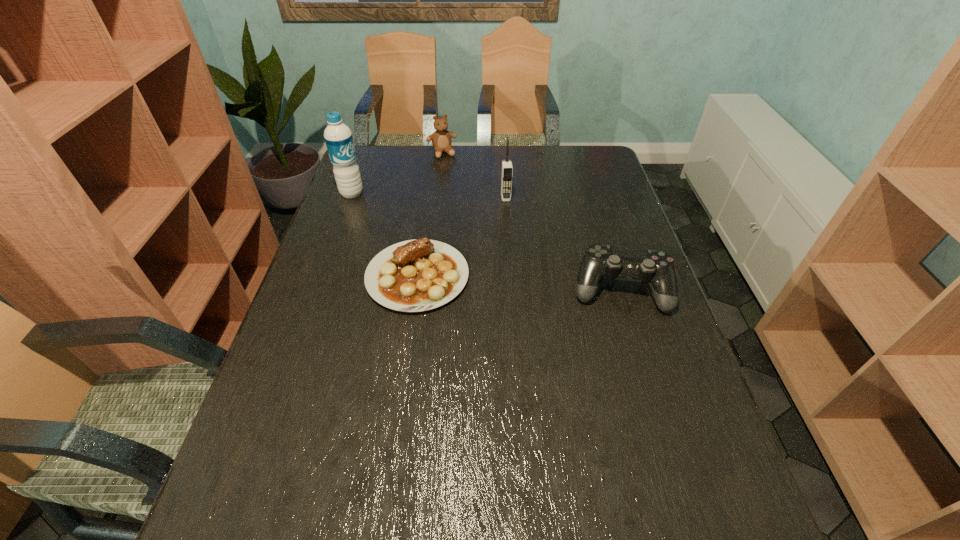
Identify the location of the shortest object. The image size is (960, 540). (417, 275).

Locate an element on the screen. The width and height of the screenshot is (960, 540). control is located at coordinates (656, 268).

Identify the location of the second shortest object. This screenshot has width=960, height=540. (656, 268).

The width and height of the screenshot is (960, 540). Identify the location of water bottle. (338, 137).

At what (x,y) coordinates should I click in order to perform the action: click on the tallest object. Please return your answer as a coordinate pair (x, y). Looking at the image, I should click on (338, 137).

The image size is (960, 540). Find the location of `the third shortest object`. the third shortest object is located at coordinates (441, 139).

Locate an element on the screen. The width and height of the screenshot is (960, 540). teddy bear is located at coordinates (441, 139).

Locate an element on the screen. The width and height of the screenshot is (960, 540). the second object from right to left is located at coordinates (507, 170).

Image resolution: width=960 pixels, height=540 pixels. I want to click on cellular telephone, so click(x=507, y=170).

This screenshot has width=960, height=540. Find the location of `free region located on the left of the steak`. free region located on the left of the steak is located at coordinates (325, 276).